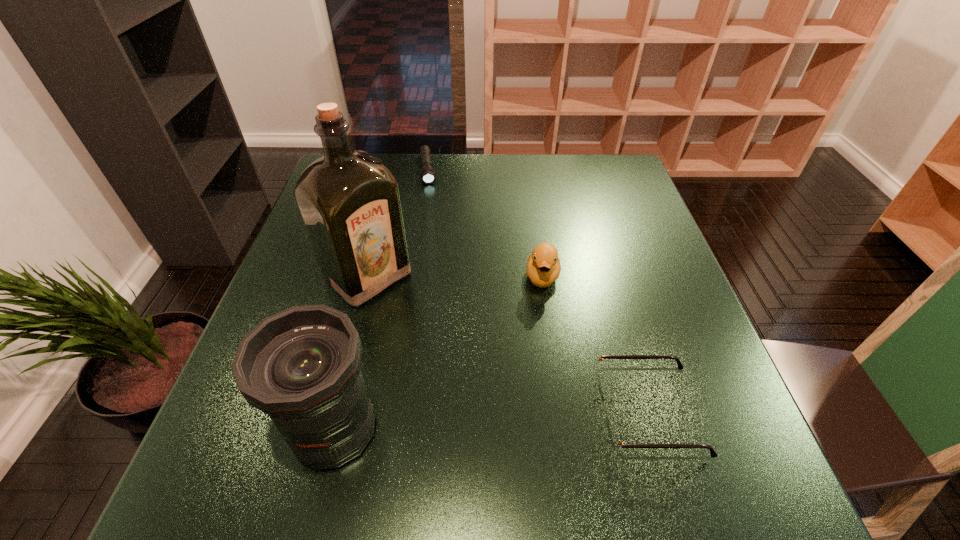
Where is `vacant space located 0.340m at the hinge ends of the spectacles`? The image size is (960, 540). vacant space located 0.340m at the hinge ends of the spectacles is located at coordinates (408, 413).

Where is `vacant space located at the hinge ends of the spectacles`? vacant space located at the hinge ends of the spectacles is located at coordinates (396, 413).

Image resolution: width=960 pixels, height=540 pixels. Identify the location of vacant space located on the face of the duckling. (536, 397).

Find the location of a particular element. This screenshot has height=540, width=960. free location located on the face of the duckling is located at coordinates (535, 417).

Find the location of a particular element. vacant space located 0.260m on the face of the duckling is located at coordinates (536, 397).

The height and width of the screenshot is (540, 960). What are the coordinates of `vacant space situated 0.160m on the label of the tallest object` in the screenshot? It's located at (442, 340).

The image size is (960, 540). In order to click on free point located 0.160m on the label of the tallest object in this screenshot , I will do `click(442, 340)`.

This screenshot has height=540, width=960. I want to click on free space located 0.180m on the label of the tallest object, so click(x=448, y=346).

Locate an element on the screen. vacant space located at the lens end of the shortest object is located at coordinates (434, 247).

Locate an element on the screen. The height and width of the screenshot is (540, 960). vacant space located 0.050m at the lens end of the shortest object is located at coordinates (428, 195).